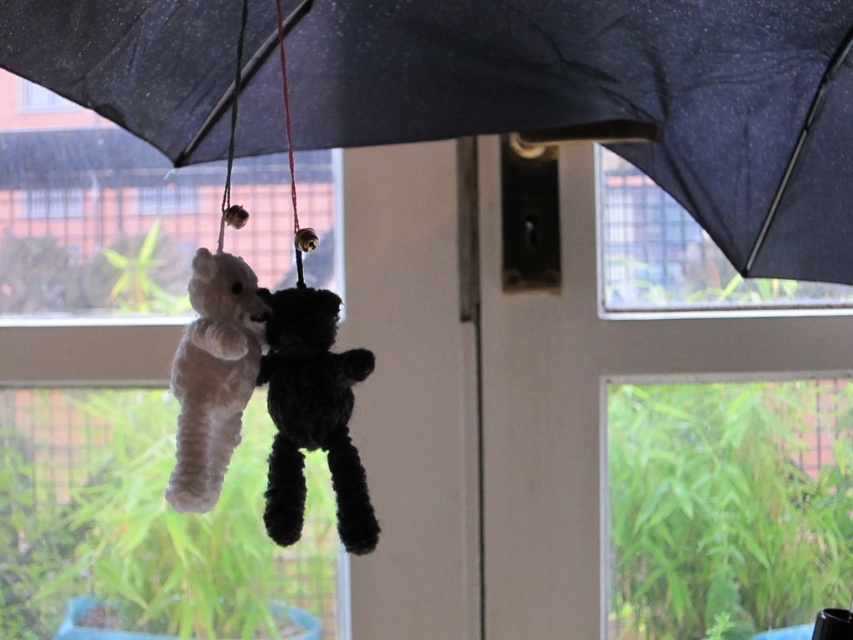
Is point (225, 77) closer to viewer compared to point (196, 449)?

That is False.

Who is shorter, black matte umbrella at upper center or white fluffy teddy bear at center?

Standing shorter between the two is white fluffy teddy bear at center.

Locate an element on the screen. This screenshot has height=640, width=853. black matte umbrella at upper center is located at coordinates (613, 99).

The width and height of the screenshot is (853, 640). I want to click on black matte umbrella at upper center, so click(x=613, y=99).

Which is more to the left, transparent glass window at upper center or transparent glass window at upper left?

transparent glass window at upper left

Does transparent glass window at upper center have a lesser height compared to transparent glass window at upper left?

Incorrect, transparent glass window at upper center's height does not fall short of transparent glass window at upper left's.

Where is `transparent glass window at upper center`? Image resolution: width=853 pixels, height=640 pixels. transparent glass window at upper center is located at coordinates pyautogui.click(x=677, y=257).

Does black matte umbrella at upper center appear on the left side of black fuzzy bear at center?

Incorrect, black matte umbrella at upper center is not on the left side of black fuzzy bear at center.

What do you see at coordinates (613, 99) in the screenshot?
I see `black matte umbrella at upper center` at bounding box center [613, 99].

Image resolution: width=853 pixels, height=640 pixels. I want to click on black matte umbrella at upper center, so click(x=613, y=99).